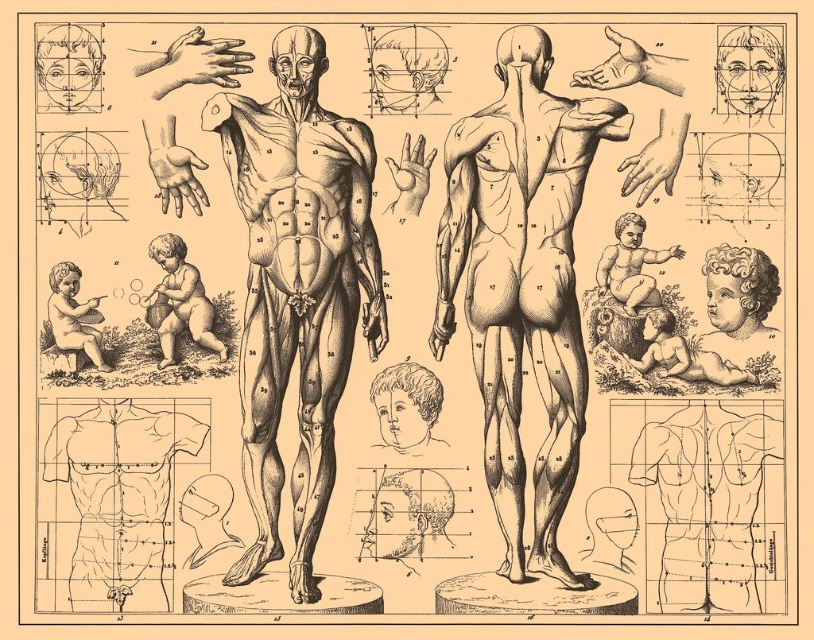
You are standing in a museum and see the black ink drawing of human body at center displayed on a wall. If the drawing is 60.90 meters away from you, can you comfortably read the small labels next to the muscles shown in the illustration?

The black ink drawing of human body at center is 60.90 meters away from the viewer. At this distance, it would be difficult to comfortably read the small labels next to the muscles shown in the illustration due to the significant distance.

You are an architect designing a new medical museum exhibit. The exhibit requires placing a scale model of the black ink drawing of human body at center and the smooth beige cherub at bottom left exactly 20 feet apart. Given the original illustration, is this feasible?

The distance between the black ink drawing of human body at center and the smooth beige cherub at bottom left in the original illustration is 74.94 feet. To place them 20 feet apart in the exhibit, the scale model would need to be reduced by approximately 26.75 percent to maintain proportionality.